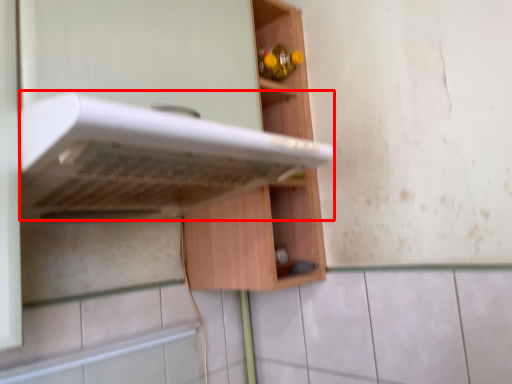
Question: From the image, what is the correct spatial relationship of oven (annotated by the red box) in relation to cabinetry?

Choices:
 (A) right
 (B) left

Answer: (B)